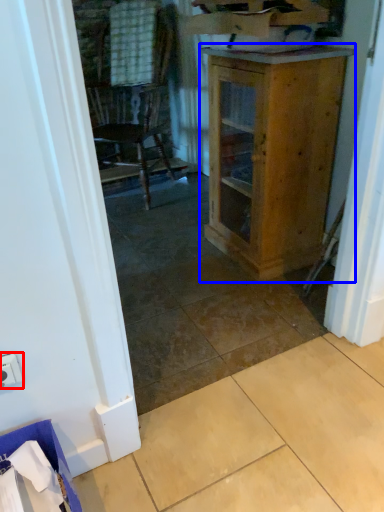
Question: Which object is further to the camera taking this photo, electric outlet (highlighted by a red box) or cabinetry (highlighted by a blue box)?

Choices:
 (A) electric outlet
 (B) cabinetry

Answer: (B)